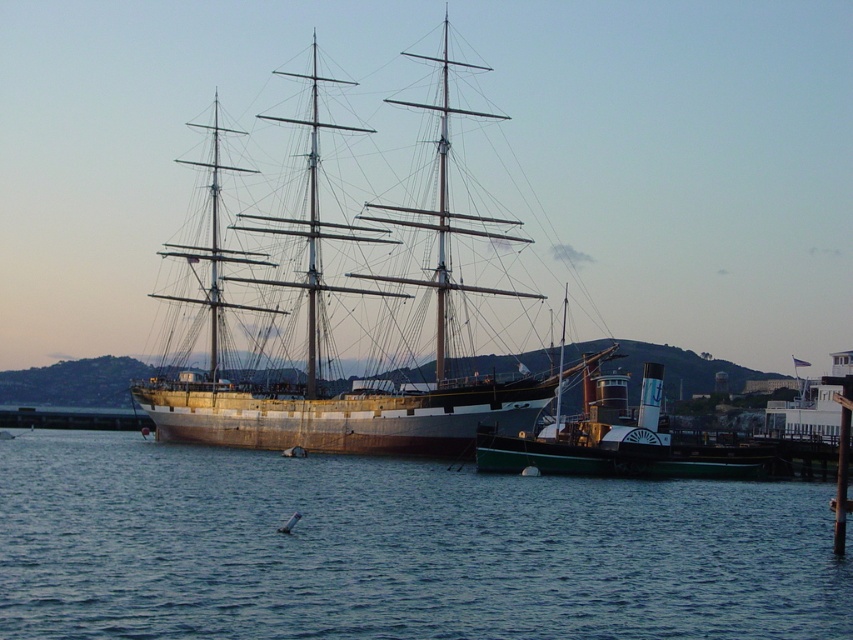
Question: Is blue water at center smaller than green matte steamboat at center?

Choices:
 (A) yes
 (B) no

Answer: (B)

Question: Which object is positioned farthest from the green matte steamboat at center?

Choices:
 (A) blue water at center
 (B) wooden ship at center

Answer: (B)

Question: Among these objects, which one is nearest to the camera?

Choices:
 (A) green matte steamboat at center
 (B) blue water at center
 (C) wooden ship at center

Answer: (B)

Question: Among these objects, which one is farthest from the camera?

Choices:
 (A) wooden ship at center
 (B) green matte steamboat at center
 (C) blue water at center

Answer: (A)

Question: Is blue water at center above green matte steamboat at center?

Choices:
 (A) yes
 (B) no

Answer: (B)

Question: Does wooden ship at center come behind green matte steamboat at center?

Choices:
 (A) no
 (B) yes

Answer: (B)